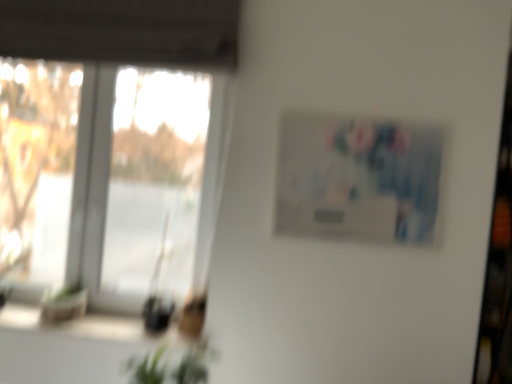
Question: From a real-world perspective, is green leafy plant at lower center located beneath transparent glass window at left?

Choices:
 (A) no
 (B) yes

Answer: (B)

Question: Considering the relative positions of green leafy plant at lower center and transparent glass window at left in the image provided, is green leafy plant at lower center in front of transparent glass window at left?

Choices:
 (A) yes
 (B) no

Answer: (A)

Question: From the image's perspective, does green leafy plant at lower center appear higher than transparent glass window at left?

Choices:
 (A) yes
 (B) no

Answer: (B)

Question: Can you confirm if green leafy plant at lower center is taller than transparent glass window at left?

Choices:
 (A) yes
 (B) no

Answer: (B)

Question: From the image's perspective, is green leafy plant at lower center beneath transparent glass window at left?

Choices:
 (A) yes
 (B) no

Answer: (A)

Question: From the image's perspective, is green leafy plant at lower center positioned above or below green leafy plant at lower left?

Choices:
 (A) below
 (B) above

Answer: (A)

Question: Considering the relative positions of green leafy plant at lower center and green leafy plant at lower left in the image provided, is green leafy plant at lower center to the left or to the right of green leafy plant at lower left?

Choices:
 (A) right
 (B) left

Answer: (A)

Question: From a real-world perspective, is green leafy plant at lower center physically located above or below green leafy plant at lower left?

Choices:
 (A) below
 (B) above

Answer: (B)

Question: Considering the positions of green leafy plant at lower center and green leafy plant at lower left in the image, is green leafy plant at lower center wider or thinner than green leafy plant at lower left?

Choices:
 (A) wide
 (B) thin

Answer: (B)

Question: Considering the positions of matte plastic picture frame at upper right and transparent glass window at left in the image, is matte plastic picture frame at upper right taller or shorter than transparent glass window at left?

Choices:
 (A) tall
 (B) short

Answer: (B)

Question: In terms of size, does matte plastic picture frame at upper right appear bigger or smaller than transparent glass window at left?

Choices:
 (A) small
 (B) big

Answer: (A)

Question: From a real-world perspective, is matte plastic picture frame at upper right positioned above or below transparent glass window at left?

Choices:
 (A) below
 (B) above

Answer: (B)

Question: From the image's perspective, relative to transparent glass window at left, is matte plastic picture frame at upper right above or below?

Choices:
 (A) above
 (B) below

Answer: (A)

Question: From their relative heights in the image, would you say matte plastic picture frame at upper right is taller or shorter than green leafy plant at lower center?

Choices:
 (A) tall
 (B) short

Answer: (A)

Question: Is matte plastic picture frame at upper right inside the boundaries of green leafy plant at lower center, or outside?

Choices:
 (A) outside
 (B) inside

Answer: (A)